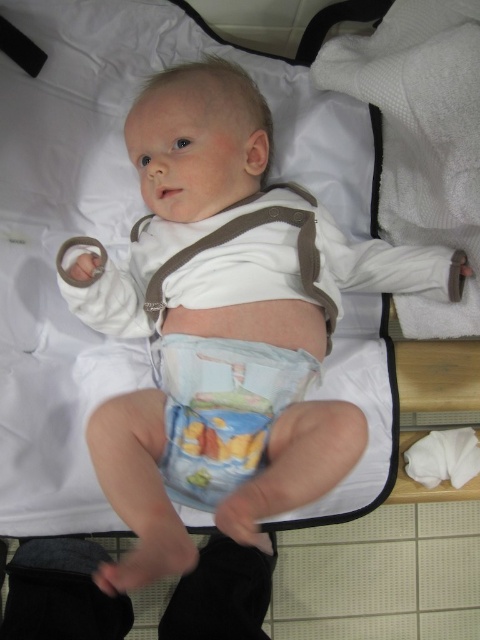
Is blue printed fabric diaper at center shorter than white cotton bib at center?

Yes, blue printed fabric diaper at center is shorter than white cotton bib at center.

Is point (179, 502) positioned after point (277, 220)?

No.

At what (x,y) coordinates should I click in order to perform the action: click on blue printed fabric diaper at center. Please return your answer as a coordinate pair (x, y). Image resolution: width=480 pixels, height=640 pixels. Looking at the image, I should click on (222, 410).